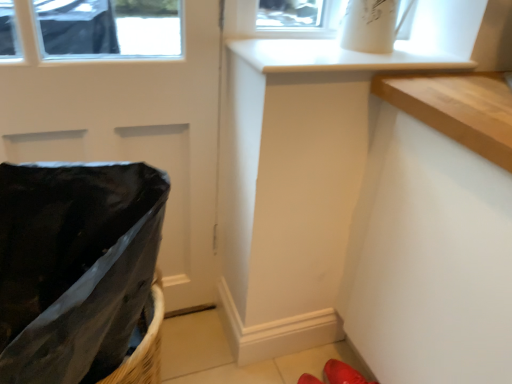
Question: Considering the positions of glossy black door at left and red rubber shoes at lower right in the image, is glossy black door at left taller or shorter than red rubber shoes at lower right?

Choices:
 (A) short
 (B) tall

Answer: (B)

Question: From a real-world perspective, relative to red rubber shoes at lower right, is glossy black door at left vertically above or below?

Choices:
 (A) above
 (B) below

Answer: (A)

Question: Which is farther from the glossy black door at left?

Choices:
 (A) red rubber shoes at lower right
 (B) black plastic laundry basket at left

Answer: (A)

Question: Which object is the farthest from the black plastic laundry basket at left?

Choices:
 (A) glossy black door at left
 (B) red rubber shoes at lower right

Answer: (B)